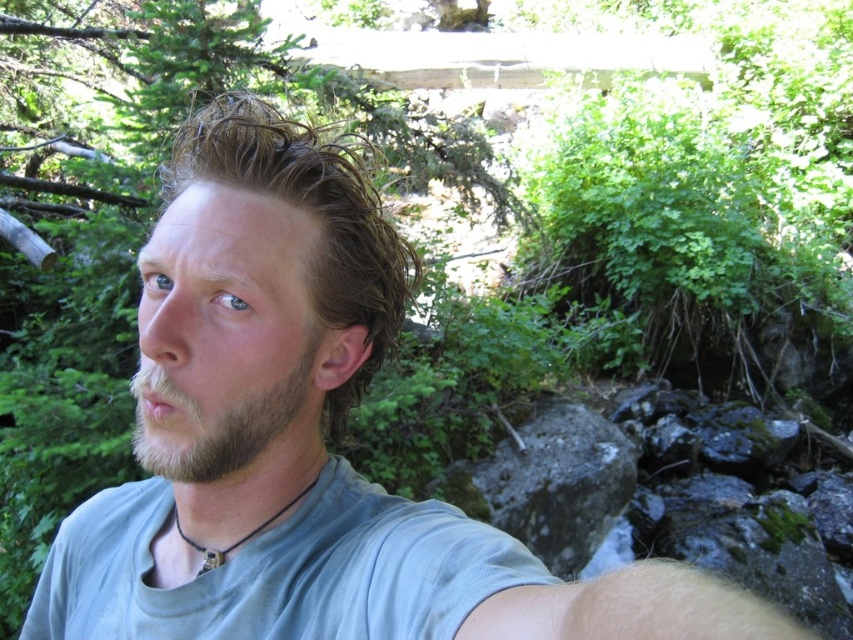
Question: Which object appears farthest from the camera in this image?

Choices:
 (A) brown fuzzy hair at center
 (B) brown fuzzy beard at lower left

Answer: (A)

Question: Is brown fuzzy hair at center to the right of brown fuzzy beard at lower left from the viewer's perspective?

Choices:
 (A) yes
 (B) no

Answer: (B)

Question: Can you confirm if brown fuzzy hair at center is positioned below brown fuzzy beard at lower left?

Choices:
 (A) yes
 (B) no

Answer: (B)

Question: Is brown fuzzy hair at center closer to camera compared to brown fuzzy beard at lower left?

Choices:
 (A) no
 (B) yes

Answer: (A)